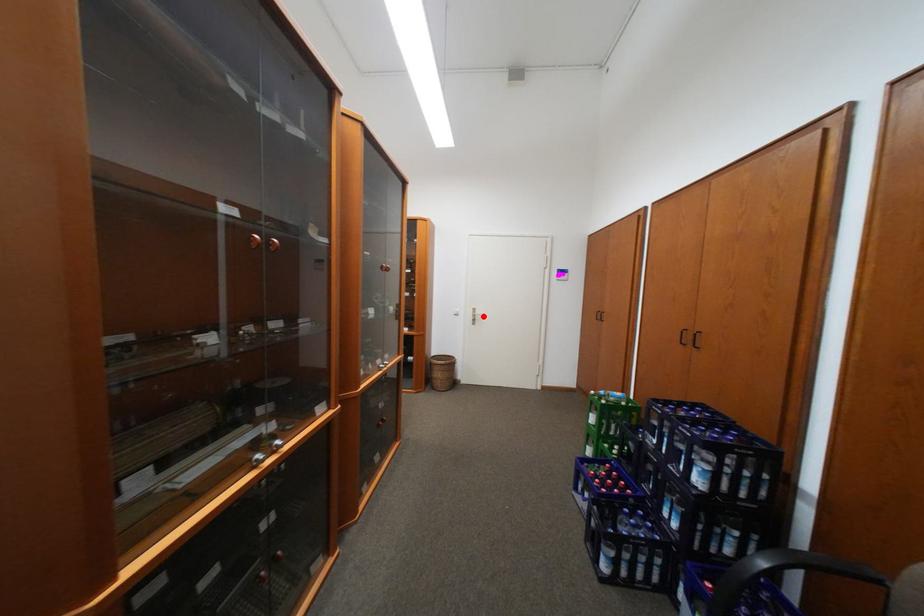
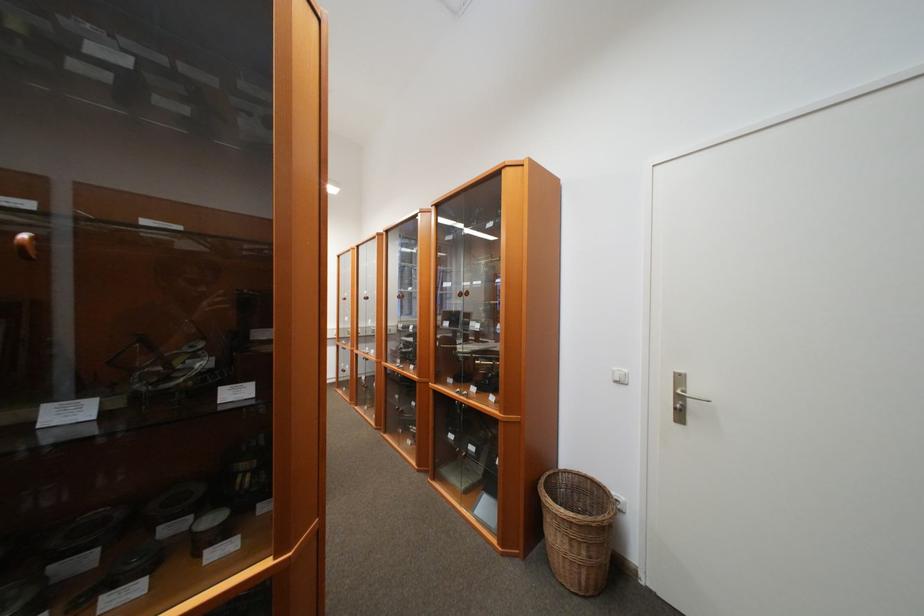
Find the pixel in the second image that matches the highlighted location in the first image.

(689, 399)